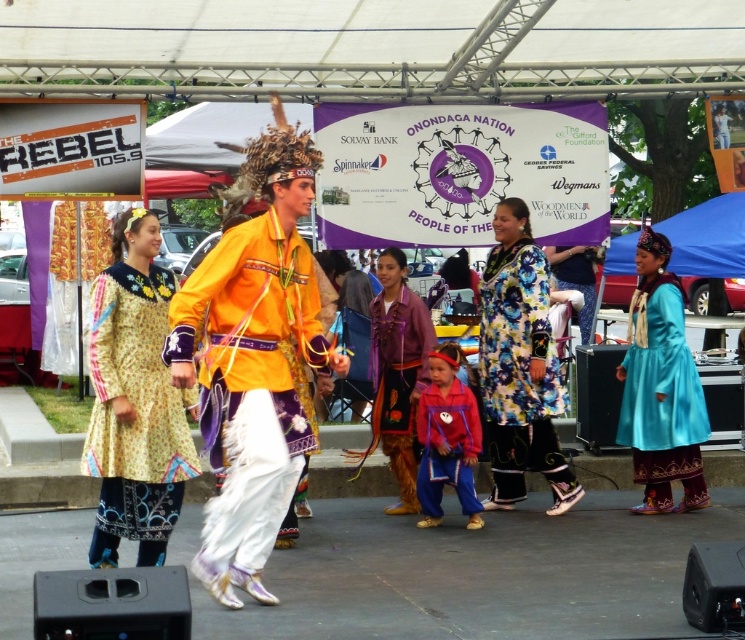
Question: In this image, where is floral fabric dress at center located relative to matte red jacket at center?

Choices:
 (A) left
 (B) right

Answer: (B)

Question: Is floral fabric dress at center below matte purple dress at center?

Choices:
 (A) yes
 (B) no

Answer: (B)

Question: Which point is closer to the camera?

Choices:
 (A) matte purple dress at center
 (B) yellow satin shirt at center
 (C) floral fabric dress at center

Answer: (B)

Question: Based on their relative distances, which object is farther from the yellow floral dress at center?

Choices:
 (A) turquoise satin dress at lower right
 (B) yellow satin shirt at center
 (C) matte purple dress at center
 (D) floral fabric dress at center

Answer: (A)

Question: Is yellow floral dress at center to the right of turquoise satin dress at lower right from the viewer's perspective?

Choices:
 (A) no
 (B) yes

Answer: (A)

Question: Which is farther from the floral fabric dress at center?

Choices:
 (A) matte red jacket at center
 (B) turquoise satin dress at lower right
 (C) yellow satin shirt at center
 (D) yellow floral dress at center

Answer: (D)